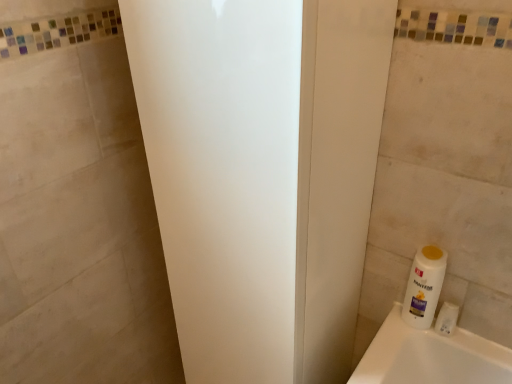
Question: Is point (430, 276) positioned closer to the camera than point (146, 24)?

Choices:
 (A) closer
 (B) farther

Answer: (B)

Question: From their relative heights in the image, would you say white plastic bottle at lower right is taller or shorter than white matte screen door at center?

Choices:
 (A) short
 (B) tall

Answer: (A)

Question: Considering the real-world distances, which object is farthest from the white matte screen door at center?

Choices:
 (A) white plastic bottle at lower right
 (B) white plastic bottle at lower right

Answer: (A)

Question: Which object is the closest to the white matte screen door at center?

Choices:
 (A) white plastic bottle at lower right
 (B) white plastic bottle at lower right

Answer: (B)